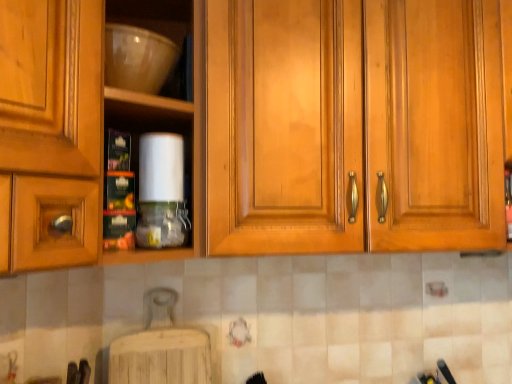
Describe the element at coordinates (162, 225) in the screenshot. I see `translucent plastic bottle at center` at that location.

The height and width of the screenshot is (384, 512). What are the coordinates of `translucent plastic bottle at center` in the screenshot? It's located at (162, 225).

Measure the distance between matte wood cabinets at center and camera.

They are 23.11 inches apart.

What is the approximate height of matte white bowl at upper left?

matte white bowl at upper left is 5.67 inches tall.

The width and height of the screenshot is (512, 384). I want to click on matte white bowl at upper left, so click(x=154, y=16).

At what (x,y) coordinates should I click in order to perform the action: click on translucent plastic bottle at center. Please return your answer as a coordinate pair (x, y). Image resolution: width=512 pixels, height=384 pixels. Looking at the image, I should click on (162, 225).

From the image's perspective, is matte wood cabinets at center under matte white bowl at upper left?

Yes, from the image's perspective, matte wood cabinets at center is below matte white bowl at upper left.

Could you tell me if matte wood cabinets at center is facing matte white bowl at upper left?

No, matte wood cabinets at center is not aimed at matte white bowl at upper left.

From a real-world perspective, who is located higher, matte wood cabinets at center or matte white bowl at upper left?

matte wood cabinets at center.

Which is correct: matte wood cabinets at center is inside matte white bowl at upper left, or outside of it?

matte wood cabinets at center is located beyond the bounds of matte white bowl at upper left.

From the image's perspective, relative to matte white bowl at upper left, is translucent plastic bottle at center above or below?

From the image's perspective, translucent plastic bottle at center appears below matte white bowl at upper left.

Is point (162, 218) closer to camera compared to point (132, 0)?

Yes, point (162, 218) is in front of point (132, 0).

Which is more to the right, translucent plastic bottle at center or matte white bowl at upper left?

Positioned to the right is translucent plastic bottle at center.

I want to click on bottle behind the matte white bowl at upper left, so click(x=162, y=225).

Are matte white bowl at upper left and translucent plastic bottle at center beside each other?

matte white bowl at upper left is not next to translucent plastic bottle at center, and they're not touching.

How much distance is there between matte white bowl at upper left and translucent plastic bottle at center?

A distance of 17.95 inches exists between matte white bowl at upper left and translucent plastic bottle at center.

The width and height of the screenshot is (512, 384). Identify the location of shelf above the translucent plastic bottle at center (from a real-world perspective). (154, 16).

Can you confirm if matte white bowl at upper left is shorter than translucent plastic bottle at center?

In fact, matte white bowl at upper left may be taller than translucent plastic bottle at center.

Considering the relative sizes of matte wood cabinets at center and translucent plastic bottle at center in the image provided, is matte wood cabinets at center shorter than translucent plastic bottle at center?

Incorrect, the height of matte wood cabinets at center does not fall short of that of translucent plastic bottle at center.

Is matte wood cabinets at center facing away from translucent plastic bottle at center?

matte wood cabinets at center is not turned away from translucent plastic bottle at center.

You are a GUI agent. You are given a task and a screenshot of the screen. Output one action in this format:
    pyautogui.click(x=<x>, y=<y>)
    Task: Click on the bottle below the matte wood cabinets at center (from the image's perspective)
    The width and height of the screenshot is (512, 384).
    Given the screenshot: What is the action you would take?
    [162, 225]

From a real-world perspective, does matte wood cabinets at center stand above translucent plastic bottle at center?

Yes.

Considering the positions of objects matte white bowl at upper left and matte wood cabinets at center in the image provided, who is more to the right, matte white bowl at upper left or matte wood cabinets at center?

matte wood cabinets at center is more to the right.

Is matte white bowl at upper left wider than matte wood cabinets at center?

Incorrect, the width of matte white bowl at upper left does not surpass that of matte wood cabinets at center.

Locate an element on the screen. The image size is (512, 384). shelf located underneath the matte wood cabinets at center (from a real-world perspective) is located at coordinates (154, 16).

How distant is translucent plastic bottle at center from matte wood cabinets at center?

A distance of 13.63 inches exists between translucent plastic bottle at center and matte wood cabinets at center.

Considering the relative positions of translucent plastic bottle at center and matte wood cabinets at center in the image provided, is translucent plastic bottle at center to the right of matte wood cabinets at center from the viewer's perspective?

In fact, translucent plastic bottle at center is to the left of matte wood cabinets at center.

Can you confirm if translucent plastic bottle at center is shorter than matte wood cabinets at center?

Correct, translucent plastic bottle at center is not as tall as matte wood cabinets at center.

What are the coordinates of `shelf in front of the matte wood cabinets at center` in the screenshot? It's located at (154, 16).

This screenshot has width=512, height=384. I want to click on bottle that is under the matte white bowl at upper left (from a real-world perspective), so click(162, 225).

From the image, which object appears to be farther from translucent plastic bottle at center, matte white bowl at upper left or matte wood cabinets at center?

matte white bowl at upper left lies further to translucent plastic bottle at center than the other object.

When comparing their distances from matte white bowl at upper left, does translucent plastic bottle at center or matte wood cabinets at center seem further?

translucent plastic bottle at center lies further to matte white bowl at upper left than the other object.

Based on their spatial positions, is matte white bowl at upper left or translucent plastic bottle at center closer to matte wood cabinets at center?

Among the two, translucent plastic bottle at center is located nearer to matte wood cabinets at center.

Based on their spatial positions, is translucent plastic bottle at center or matte white bowl at upper left further from matte wood cabinets at center?

The object further to matte wood cabinets at center is matte white bowl at upper left.

From the image, which object appears to be nearer to translucent plastic bottle at center, matte wood cabinets at center or matte white bowl at upper left?

Among the two, matte wood cabinets at center is located nearer to translucent plastic bottle at center.

Considering their positions, is matte wood cabinets at center positioned further to matte white bowl at upper left than translucent plastic bottle at center?

Among the two, translucent plastic bottle at center is located further to matte white bowl at upper left.

This screenshot has height=384, width=512. Find the location of `bottle located between matte white bowl at upper left and matte wood cabinets at center in the left-right direction`. bottle located between matte white bowl at upper left and matte wood cabinets at center in the left-right direction is located at coordinates (162, 225).